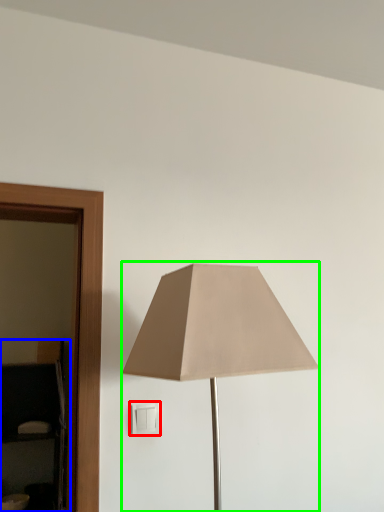
Question: Estimate the real-world distances between objects in this image. Which object is closer to light switch (highlighted by a red box), dresser (highlighted by a blue box) or lamp (highlighted by a green box)?

Choices:
 (A) dresser
 (B) lamp

Answer: (B)